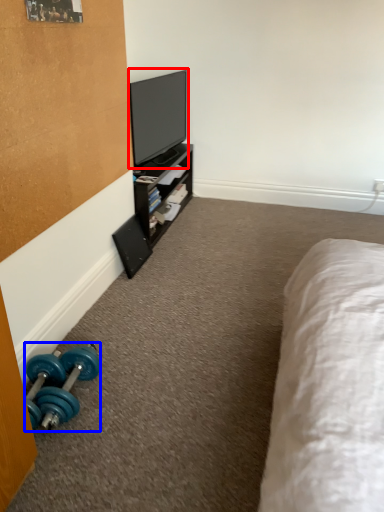
Question: Which object appears farthest to the camera in this image, television (highlighted by a red box) or dumbbell (highlighted by a blue box)?

Choices:
 (A) television
 (B) dumbbell

Answer: (A)